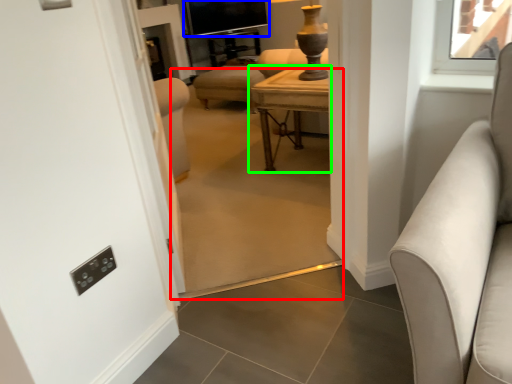
Question: Estimate the real-world distances between objects in this image. Which object is closer to plain (highlighted by a red box), window screen (highlighted by a blue box) or table (highlighted by a green box)?

Choices:
 (A) window screen
 (B) table

Answer: (B)